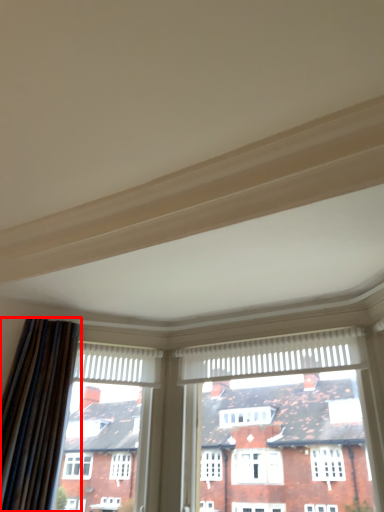
Question: From the image's perspective, considering the relative positions of curtain (annotated by the red box) and window in the image provided, where is curtain (annotated by the red box) located with respect to the staircase?

Choices:
 (A) above
 (B) below

Answer: (A)